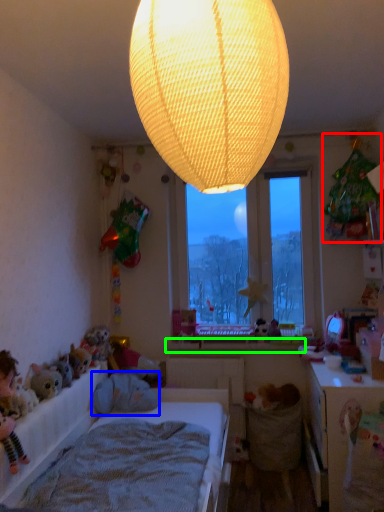
Question: Which object is positioned closest to toy (highlighted by a red box)? Select from animal (highlighted by a blue box) and window sill (highlighted by a green box).

Choices:
 (A) animal
 (B) window sill

Answer: (B)